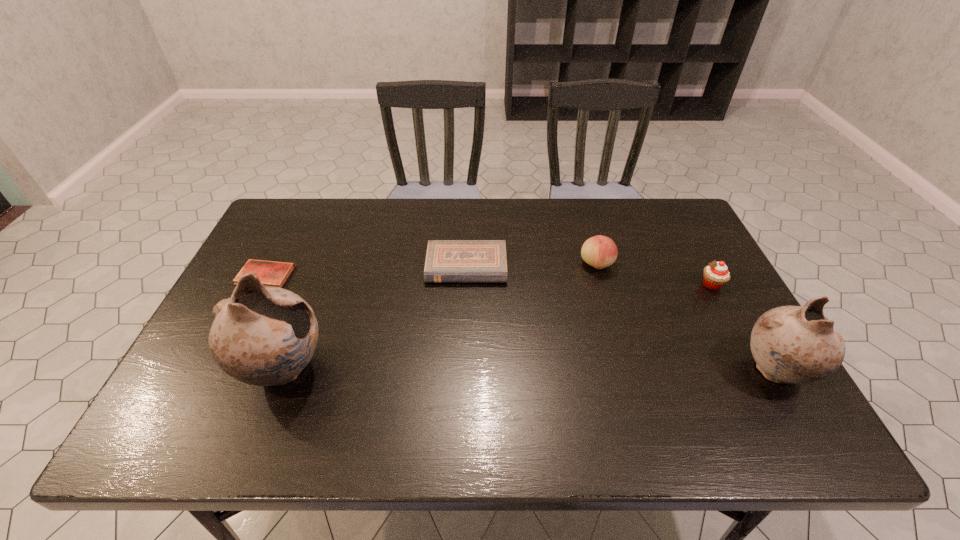
What are the coordinates of `free space located on the left of the third object from right to left` in the screenshot? It's located at 545,264.

I want to click on vacant space situated on the back of the cupcake, so click(x=666, y=199).

Find the location of a particular element. vacant space located 0.190m on the spine side of the fourth object from right to left is located at coordinates (464, 339).

The image size is (960, 540). I want to click on free space located 0.160m on the right of the diary, so click(x=348, y=275).

Find the location of a particular element. Image resolution: width=960 pixels, height=540 pixels. pottery that is at the left edge is located at coordinates (263, 336).

Find the location of a particular element. This screenshot has width=960, height=540. diary that is at the left edge is located at coordinates (270, 273).

The width and height of the screenshot is (960, 540). In order to click on pottery situated at the right edge in this screenshot , I will do `click(790, 344)`.

At what (x,y) coordinates should I click in order to perform the action: click on cupcake at the right edge. Please return your answer as a coordinate pair (x, y). The height and width of the screenshot is (540, 960). Looking at the image, I should click on (716, 274).

Image resolution: width=960 pixels, height=540 pixels. I want to click on object present at the near left corner, so click(x=263, y=336).

Locate an element on the screen. The width and height of the screenshot is (960, 540). object at the near right corner is located at coordinates (790, 344).